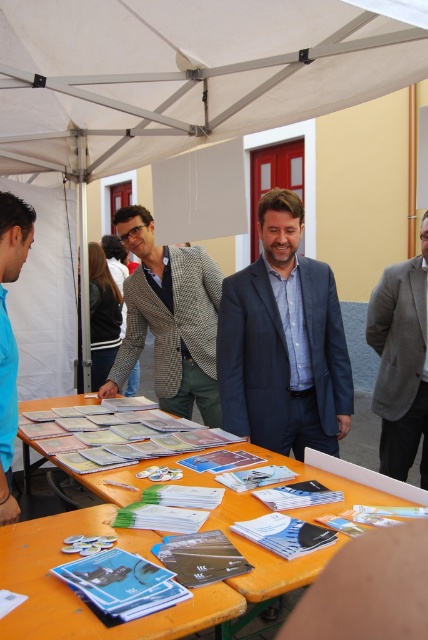
You are attending an outdoor event and notice the beige fabric canopy at upper center and the matte paper brochures at center. Which object is bigger in size?

The beige fabric canopy at upper center is larger in size than the matte paper brochures at center.

In the scene shown: You are an attendee at this event and want to know if the beige fabric canopy at upper center can provide shade for the gray woolen blazer at center. Based on their sizes, can the canopy cover the blazer?

The beige fabric canopy at upper center has a larger width than the gray woolen blazer at center, so yes, the canopy can provide shade for the blazer as it is wider.

You are organizing an event and need to place a new sign that is the same size as the blue fabric shirt at left. Can the orange paper at lower center accommodate the sign without overlapping?

The orange paper at lower center is larger in size than the blue fabric shirt at left, so it can accommodate the sign without overlapping.